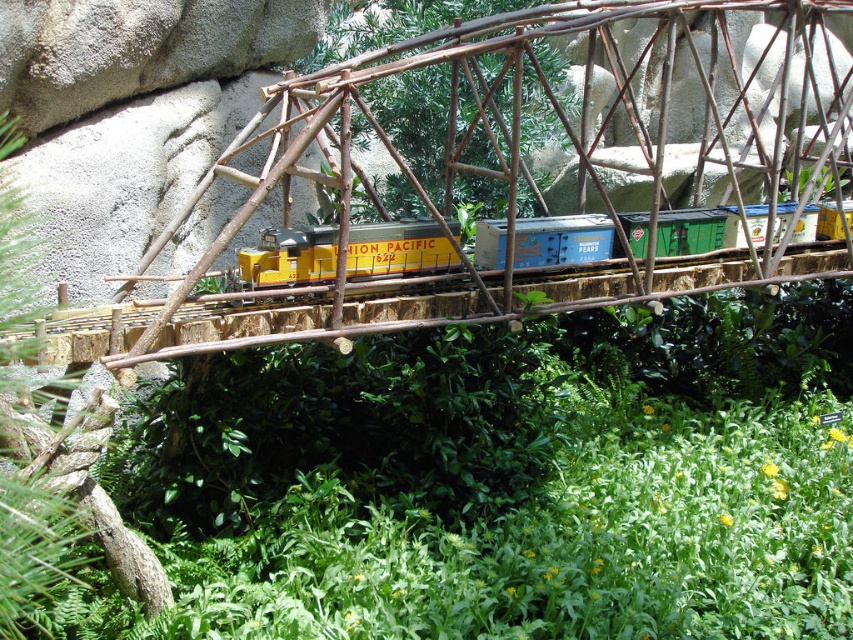
Is brown textured wood bridge at center thinner than yellow matte train car at center?

Yes, brown textured wood bridge at center is thinner than yellow matte train car at center.

Which of these two, brown textured wood bridge at center or yellow matte train car at center, stands taller?

brown textured wood bridge at center

Locate an element on the screen. The width and height of the screenshot is (853, 640). brown textured wood bridge at center is located at coordinates (415, 120).

Locate an element on the screen. Image resolution: width=853 pixels, height=640 pixels. brown textured wood bridge at center is located at coordinates (415, 120).